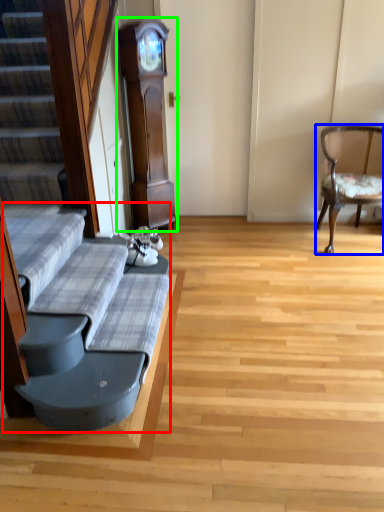
Question: Which object is the farthest from couch (highlighted by a red box)? Choose among these: chair (highlighted by a blue box) or cabinetry (highlighted by a green box).

Choices:
 (A) chair
 (B) cabinetry

Answer: (A)